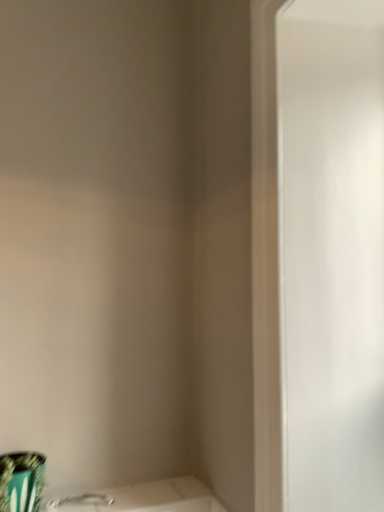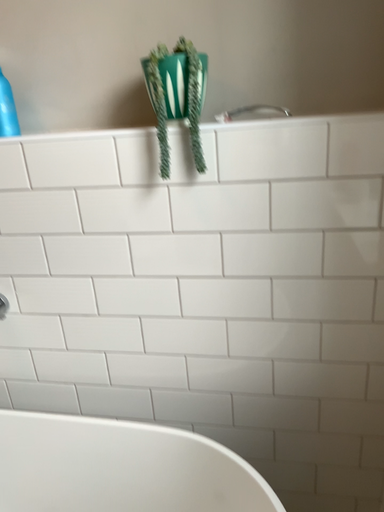
Question: Which way did the camera rotate in the video?

Choices:
 (A) rotated right
 (B) rotated left

Answer: (B)